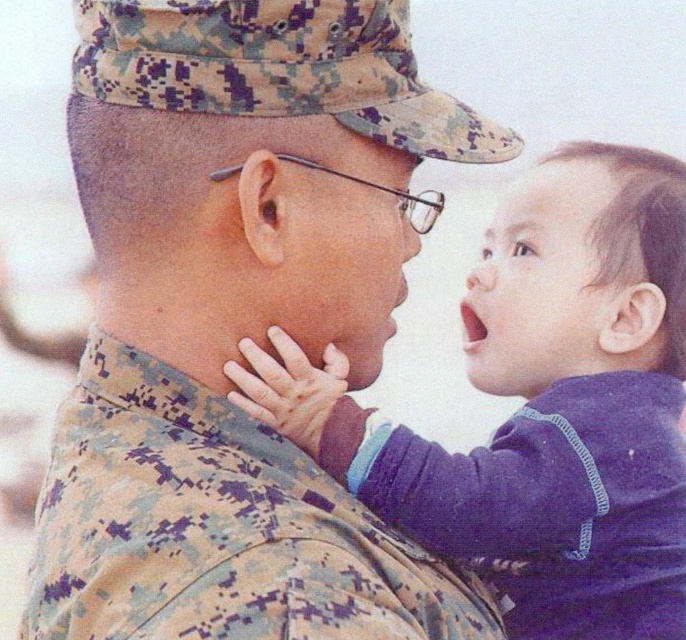
You are a photographer observing the scene. You notice the camouflage uniform at center and the purple fleece sleeve at center. Which one is positioned higher in the image?

The camouflage uniform at center is located above the purple fleece sleeve at center, so it is positioned higher in the image.

You are a photographer trying to capture the interaction between the two subjects in the image. Since both the camouflage uniform at center and the purple fleece sleeve at center are at the center, which one is closer to the camera?

The camouflage uniform at center is in front of the purple fleece sleeve at center, so it is closer to the camera.

You are a photographer trying to capture a candid shot of the man and child in the scene. To ensure both the camouflage uniform at center and the purple fleece jacket at center are in focus, which object should you position your camera focus closer to?

You should position your camera focus closer to the purple fleece jacket at center because the camouflage uniform at center is to the left of it, meaning the purple fleece jacket is closer to the camera.